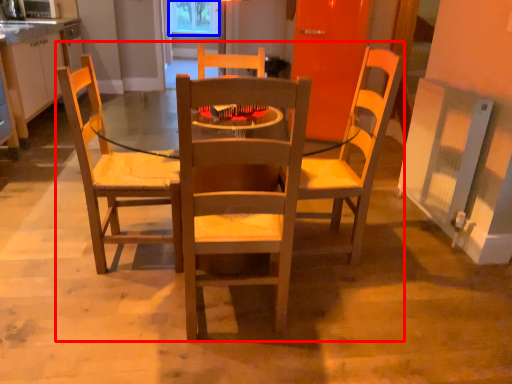
Question: Which object is closer to the camera taking this photo, trio (highlighted by a red box) or window screen (highlighted by a blue box)?

Choices:
 (A) trio
 (B) window screen

Answer: (A)